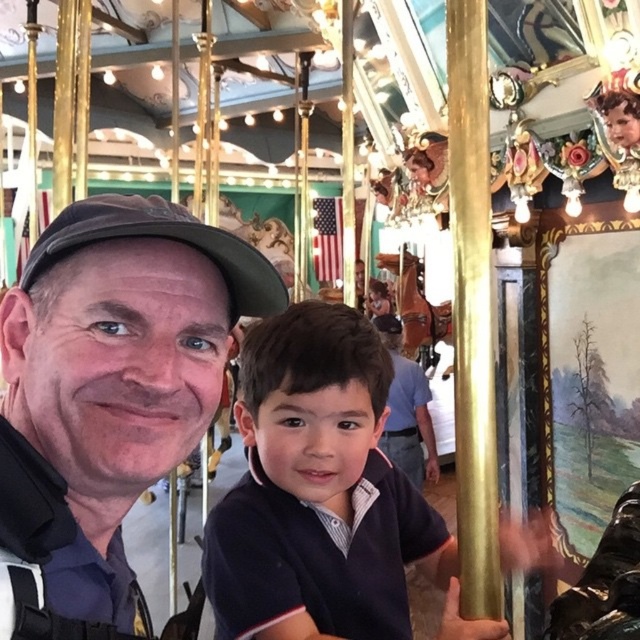
Question: Does matte black cap at left have a smaller size compared to dark blue shirt at center?

Choices:
 (A) no
 (B) yes

Answer: (B)

Question: Which of the following is the closest to the observer?

Choices:
 (A) matte black cap at left
 (B) dark blue shirt at center

Answer: (A)

Question: Where is matte black cap at left located in relation to dark blue shirt at center in the image?

Choices:
 (A) below
 (B) above

Answer: (B)

Question: Is matte black cap at left to the right of dark blue shirt at center from the viewer's perspective?

Choices:
 (A) no
 (B) yes

Answer: (A)

Question: Which point is farther to the camera?

Choices:
 (A) (308, 403)
 (B) (198, 228)

Answer: (A)